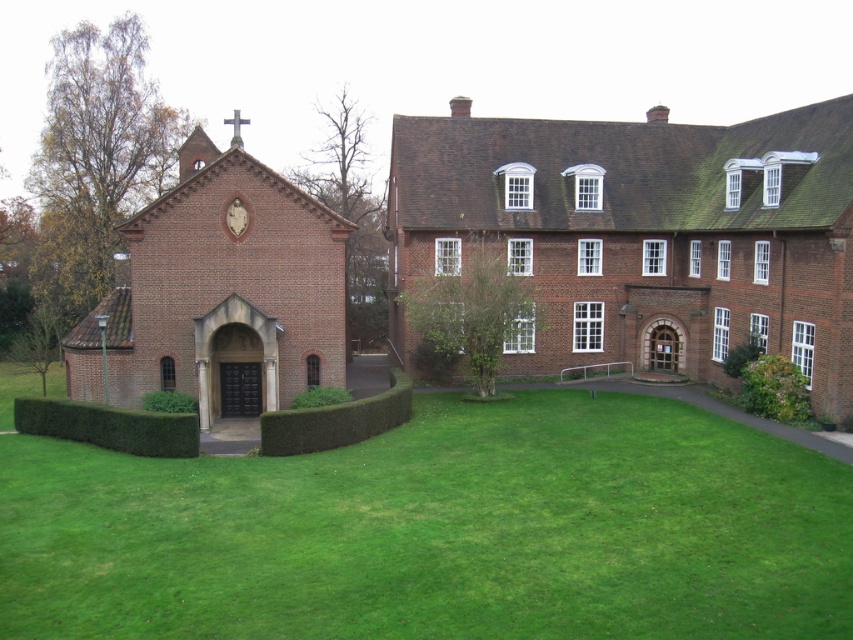
Does green grass at lower left appear over brown brick building at center?

Actually, green grass at lower left is below brown brick building at center.

Does green grass at lower left have a smaller size compared to brown brick building at center?

Indeed, green grass at lower left has a smaller size compared to brown brick building at center.

Is point (657, 557) farther from viewer compared to point (686, 259)?

That is False.

Image resolution: width=853 pixels, height=640 pixels. Find the location of `green grass at lower left`. green grass at lower left is located at coordinates (438, 531).

Between point (769, 204) and point (281, 232), which one is positioned in front?

Point (769, 204) is in front.

Can you confirm if brown brick building at center is wider than brown brick chapel at left?

Yes.

Who is more distant from viewer, (503, 140) or (221, 253)?

The point (503, 140) is more distant.

At what (x,y) coordinates should I click in order to perform the action: click on brown brick building at center. Please return your answer as a coordinate pair (x, y). Image resolution: width=853 pixels, height=640 pixels. Looking at the image, I should click on (646, 234).

Who is more forward, (599,396) or (309,266)?

Point (309,266)

Is green grass at lower left smaller than brown brick chapel at left?

Yes, green grass at lower left is smaller than brown brick chapel at left.

Locate an element on the screen. This screenshot has width=853, height=640. green grass at lower left is located at coordinates (438, 531).